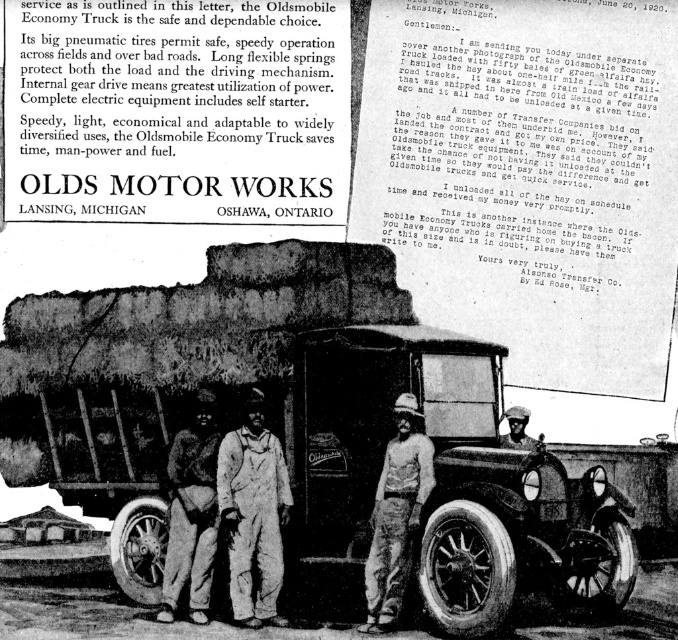
You are a mechanic inspecting the tires of the Oldsmobile Economy Truck in the image. You notice two tires on the truck. Which tire, the shiny black tire at lower right or the black rubber tire at lower left, has a bigger diameter?

The shiny black tire at lower right is larger in size than the black rubber tire at lower left, so the shiny black tire at lower right has a bigger diameter.

In the vintage Oldsmobile Economy Trucks advertisement, there are two items of clothing depicted at the center of the image. The first is a pair of light brown corduroy pants, and the second is a dark skin textured hat. Given that the observer is looking at the advertisement from a standard viewing angle, can you determine the spatial relationship between these two items? Specifically, is the light brown corduroy pants at center positioned above or below the dark skin textured hat at center?

The light brown corduroy pants at center is located below the dark skin textured hat at center, as stated in the objects description.

In the vintage Oldsmobile Economy Trucks advertisement, there are two men wearing overalls at center and light brown corduroy pants at center. Which man is positioned to the left?

The overalls at center is to the left of light brown corduroy pants at center, so the man wearing overalls at center is positioned to the left.